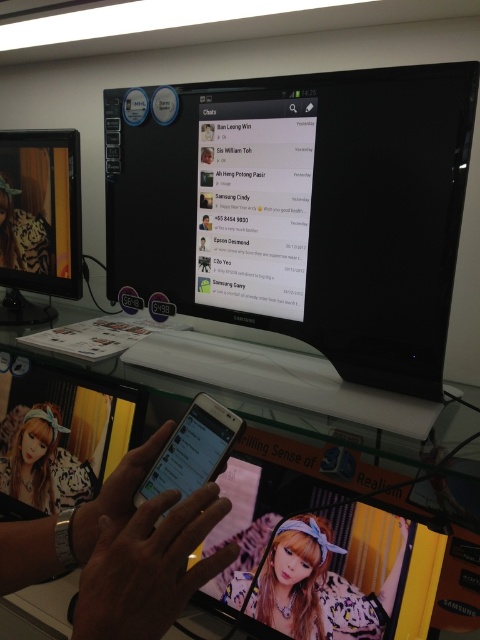
You are organizing a virtual meeting and need to locate the white tiger print jacket at center and the matte black monitor at left. According to the scene, which object is positioned to the left of the other?

The matte black monitor at left is positioned to the left of the white tiger print jacket at center.

You are organizing a virtual meeting and need to ensure all participants can see the presentation. The meeting room has a matte black monitor at left and a white tiger print jacket at center. Which object should you use to display the presentation?

The matte black monitor at left should be used to display the presentation because it has a larger size compared to the white tiger print jacket at center.

You are a delivery person who needs to place a package on the zebra print fabric at center. The package is 30 inches wide. Will it fit on the fabric without overhanging the edges?

The distance between the zebra print fabric at center and the camera is 32.59 inches. Since the package is 30 inches wide, it will fit on the fabric without overhanging the edges as the fabric is wider than the package.